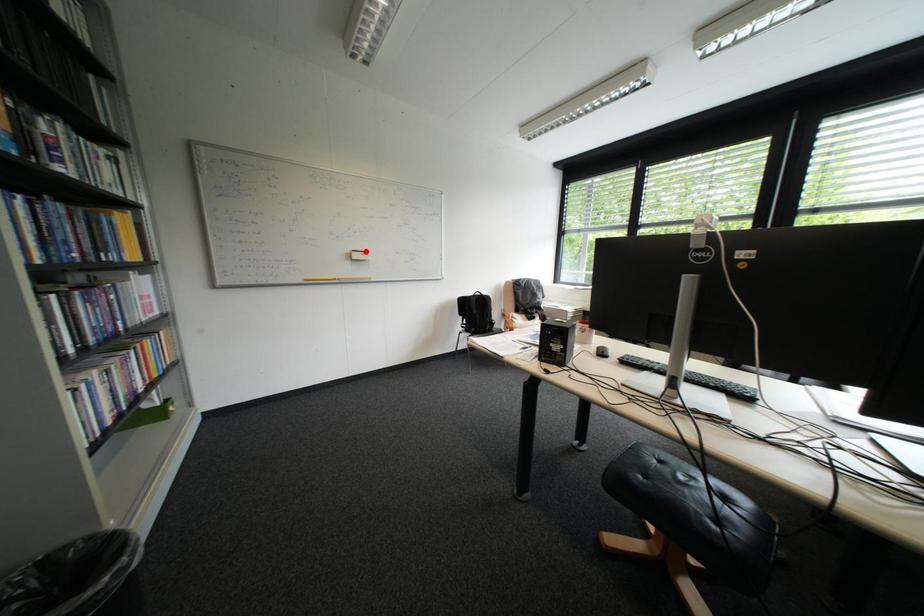
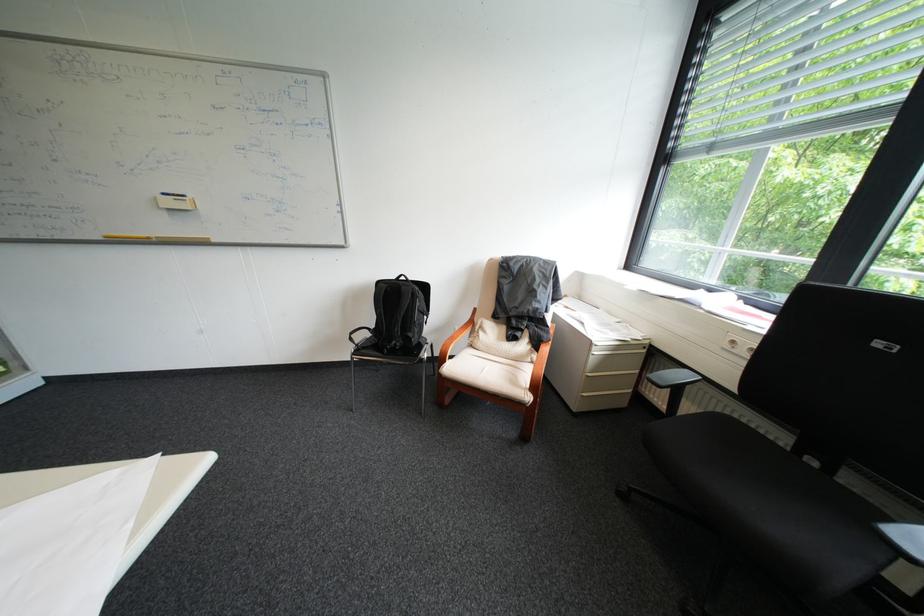
Question: I am providing you with two images of the same scene from different viewpoints. A red point is marked on the first image. At the location where the point appears in image 1, is it still visible in image 2?

Choices:
 (A) Yes
 (B) No

Answer: (A)